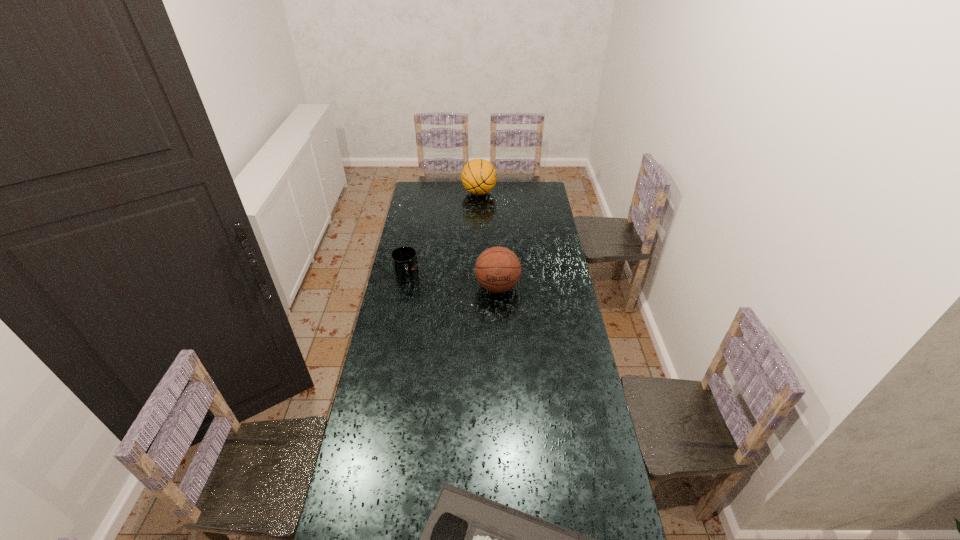
Where is `the farther basketball`? The height and width of the screenshot is (540, 960). the farther basketball is located at coordinates (479, 176).

Image resolution: width=960 pixels, height=540 pixels. Find the location of `the nearer basketball`. the nearer basketball is located at coordinates (497, 269).

Identify the location of the leftmost object. (404, 259).

Identify the location of the second shortest object. This screenshot has width=960, height=540. (404, 259).

Where is `free region located on the surface of the farther basketball near the brand logo`? free region located on the surface of the farther basketball near the brand logo is located at coordinates (516, 193).

Locate an element on the screen. blank space located on the side with brand label of the nearer basketball is located at coordinates (499, 321).

I want to click on free space located with the handle on the side of the second shortest object, so click(x=400, y=309).

This screenshot has height=540, width=960. Identify the location of object present at the far edge. (479, 176).

Find the location of a particular element. The width and height of the screenshot is (960, 540). object that is at the left edge is located at coordinates (404, 259).

The image size is (960, 540). In the image, there is a desktop. Identify the location of free space at the far edge. (451, 191).